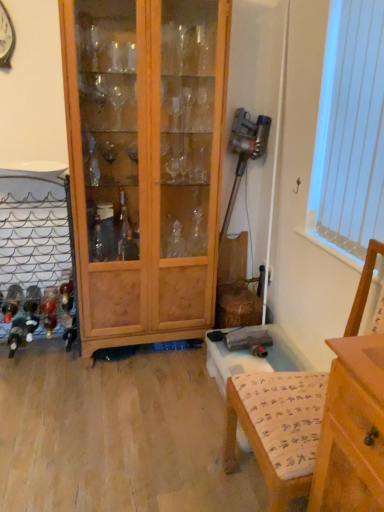
In order to face white vertical blinds at upper right, should I rotate leftwards or rightwards?

A 22.142 degree turn to the right will do.

Locate an element on the screen. wooden cabinet at center is located at coordinates (145, 163).

Is white vertical blinds at upper right at the right side of wooden cabinet at center?

Yes.

From the image's perspective, which is above, white vertical blinds at upper right or wooden cabinet at center?

white vertical blinds at upper right.

This screenshot has width=384, height=512. In the image, there is a white vertical blinds at upper right. Find the location of `cabinetry below it (from a real-world perspective)`. cabinetry below it (from a real-world perspective) is located at coordinates (145, 163).

Which object is wider, white vertical blinds at upper right or wooden cabinet at center?

With larger width is wooden cabinet at center.

Does point (273, 501) come behind point (352, 194)?

No, it is not.

How many degrees apart are the facing directions of wooden armchair at lower right and white vertical blinds at upper right?

The angle between the facing direction of wooden armchair at lower right and the facing direction of white vertical blinds at upper right is 0.202 degrees.

Measure the distance between wooden armchair at lower right and white vertical blinds at upper right.

wooden armchair at lower right and white vertical blinds at upper right are 23.96 inches apart from each other.

Considering the relative positions of wooden armchair at lower right and white vertical blinds at upper right in the image provided, is wooden armchair at lower right to the right of white vertical blinds at upper right from the viewer's perspective?

Incorrect, wooden armchair at lower right is not on the right side of white vertical blinds at upper right.

Is wooden cabinet at center inside or outside of white vertical blinds at upper right?

wooden cabinet at center is not enclosed by white vertical blinds at upper right.

Is wooden cabinet at center not close to white vertical blinds at upper right?

No, wooden cabinet at center is not far from white vertical blinds at upper right.

Does wooden cabinet at center have a lesser height compared to white vertical blinds at upper right?

Incorrect, the height of wooden cabinet at center does not fall short of that of white vertical blinds at upper right.

Would you say wooden armchair at lower right is outside wooden cabinet at center?

Yes, wooden armchair at lower right is outside of wooden cabinet at center.

Looking at this image, is wooden armchair at lower right further to camera compared to wooden cabinet at center?

No.

Can you confirm if wooden armchair at lower right is wider than wooden cabinet at center?

Yes, wooden armchair at lower right is wider than wooden cabinet at center.

Can you confirm if white vertical blinds at upper right is positioned to the left of wooden armchair at lower right?

In fact, white vertical blinds at upper right is to the right of wooden armchair at lower right.

Which object is closer to the camera, white vertical blinds at upper right or wooden armchair at lower right?

wooden armchair at lower right is more forward.

Identify the location of armchair located below the white vertical blinds at upper right (from the image's perspective). (277, 428).

Is white vertical blinds at upper right not near wooden armchair at lower right?

They are positioned close to each other.

Is wooden cabinet at center facing towards wooden armchair at lower right?

Yes, wooden cabinet at center is aimed at wooden armchair at lower right.

Which of these two, wooden cabinet at center or wooden armchair at lower right, is bigger?

With larger size is wooden cabinet at center.

Considering the relative sizes of wooden cabinet at center and wooden armchair at lower right in the image provided, is wooden cabinet at center wider than wooden armchair at lower right?

In fact, wooden cabinet at center might be narrower than wooden armchair at lower right.

Considering the positions of point (96, 146) and point (306, 484), is point (96, 146) closer or farther from the camera than point (306, 484)?

Clearly, point (96, 146) is more distant from the camera than point (306, 484).

Locate an element on the screen. window screen located above the wooden cabinet at center (from a real-world perspective) is located at coordinates (349, 132).

The width and height of the screenshot is (384, 512). I want to click on armchair located in front of the white vertical blinds at upper right, so (277, 428).

Looking at the image, which one is located closer to wooden armchair at lower right, wooden cabinet at center or white vertical blinds at upper right?

Among the two, white vertical blinds at upper right is located nearer to wooden armchair at lower right.

From the picture: From the image, which object appears to be farther from white vertical blinds at upper right, wooden cabinet at center or wooden armchair at lower right?

wooden cabinet at center lies further to white vertical blinds at upper right than the other object.

Which object lies further to the anchor point wooden armchair at lower right, white vertical blinds at upper right or wooden cabinet at center?

wooden cabinet at center is positioned further to the anchor wooden armchair at lower right.

Considering their positions, is white vertical blinds at upper right positioned closer to wooden cabinet at center than wooden armchair at lower right?

Among the two, white vertical blinds at upper right is located nearer to wooden cabinet at center.

Looking at the image, which one is located further to wooden cabinet at center, wooden armchair at lower right or white vertical blinds at upper right?

The object further to wooden cabinet at center is wooden armchair at lower right.

When comparing their distances from white vertical blinds at upper right, does wooden armchair at lower right or wooden cabinet at center seem closer?

wooden armchair at lower right.

The image size is (384, 512). Find the location of `cabinetry between white vertical blinds at upper right and wooden armchair at lower right in the vertical direction`. cabinetry between white vertical blinds at upper right and wooden armchair at lower right in the vertical direction is located at coordinates (145, 163).